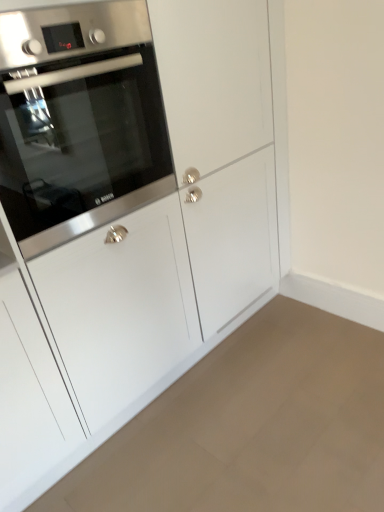
Question: Considering the relative positions of stainless steel oven at left and matte white cabinet at lower left in the image provided, is stainless steel oven at left to the left or to the right of matte white cabinet at lower left?

Choices:
 (A) right
 (B) left

Answer: (B)

Question: Is stainless steel oven at left bigger or smaller than matte white cabinet at lower left?

Choices:
 (A) big
 (B) small

Answer: (A)

Question: In the image, is stainless steel oven at left positioned in front of or behind matte white cabinet at lower left?

Choices:
 (A) front
 (B) behind

Answer: (B)

Question: Considering the relative positions of matte white cabinet at lower left and stainless steel oven at left in the image provided, is matte white cabinet at lower left to the left or to the right of stainless steel oven at left?

Choices:
 (A) right
 (B) left

Answer: (A)

Question: Is point (294, 432) positioned closer to the camera than point (94, 59)?

Choices:
 (A) farther
 (B) closer

Answer: (A)

Question: Looking at their shapes, would you say matte white cabinet at lower left is wider or thinner than stainless steel oven at left?

Choices:
 (A) thin
 (B) wide

Answer: (B)

Question: Considering the positions of matte white cabinet at lower left and stainless steel oven at left in the image, is matte white cabinet at lower left taller or shorter than stainless steel oven at left?

Choices:
 (A) short
 (B) tall

Answer: (A)